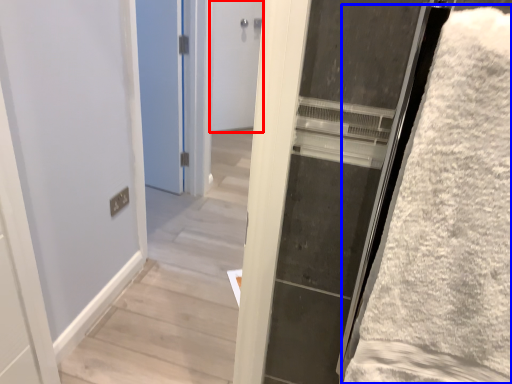
Question: Which of the following is the closest to the observer, door (highlighted by a red box) or bath towel (highlighted by a blue box)?

Choices:
 (A) door
 (B) bath towel

Answer: (B)